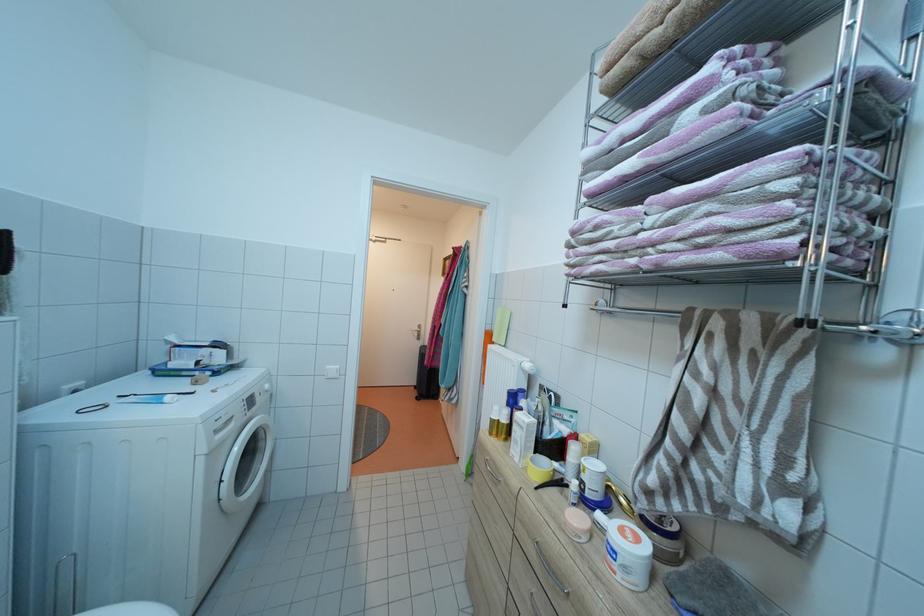
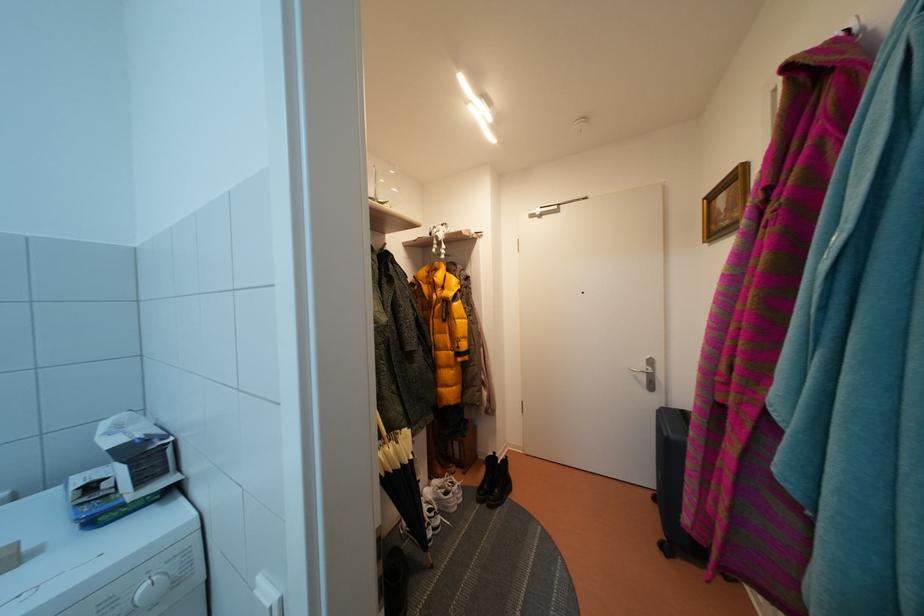
The point at (424, 334) is marked in the first image. Where is the corresponding point in the second image?

(650, 371)